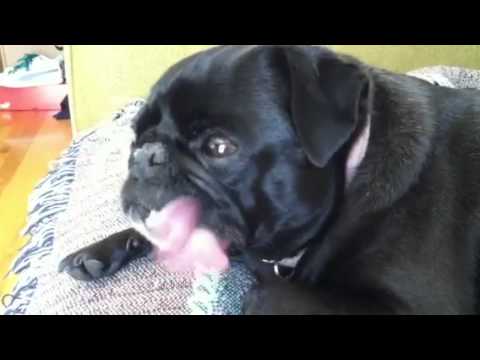
The width and height of the screenshot is (480, 360). In order to click on blanket in this screenshot , I will do `click(69, 188)`.